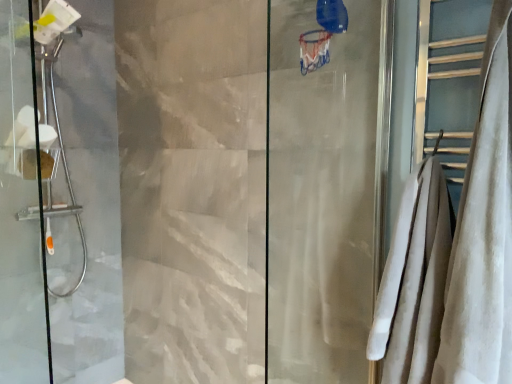
Question: Do you think white soft towel at right is within transparent glass shower door at left, marked as the 1th screen door in a front-to-back arrangement, or outside of it?

Choices:
 (A) inside
 (B) outside

Answer: (B)

Question: Relative to transparent glass shower door at left, positioned as the 2th screen door in back-to-front order, is white soft towel at right in front or behind?

Choices:
 (A) behind
 (B) front

Answer: (B)

Question: Which object is the farthest from the white velvety towel at right?

Choices:
 (A) brushed metal showerhead at left, the 1th screen door when ordered from back to front
 (B) transparent glass shower door at left, marked as the 1th screen door in a front-to-back arrangement
 (C) white soft towel at right

Answer: (B)

Question: Considering the real-world distances, which object is closest to the brushed metal showerhead at left, the second screen door positioned from the front?

Choices:
 (A) white soft towel at right
 (B) white velvety towel at right
 (C) transparent glass shower door at left, marked as the 1th screen door in a front-to-back arrangement

Answer: (C)